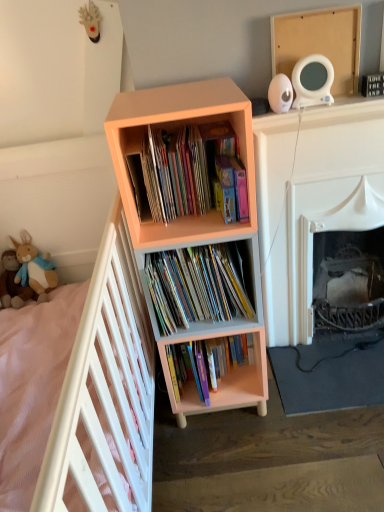
Question: Considering the relative sizes of white wooden bed at left and matte cardboard books at center, the second book when ordered from top to bottom, in the image provided, is white wooden bed at left taller than matte cardboard books at center, the second book when ordered from top to bottom,?

Choices:
 (A) no
 (B) yes

Answer: (B)

Question: Is white wooden bed at left thinner than matte cardboard books at center, which is the 2th book in bottom-to-top order?

Choices:
 (A) yes
 (B) no

Answer: (B)

Question: Is white wooden bed at left facing towards matte cardboard books at center, the second book when ordered from top to bottom?

Choices:
 (A) yes
 (B) no

Answer: (A)

Question: From a real-world perspective, is white wooden bed at left below matte cardboard books at center, which is the 2th book in bottom-to-top order?

Choices:
 (A) no
 (B) yes

Answer: (B)

Question: From a real-world perspective, is white wooden bed at left on top of matte cardboard books at center, the second book when ordered from top to bottom?

Choices:
 (A) no
 (B) yes

Answer: (A)

Question: From a real-world perspective, is hardcover books at center, the 3th book viewed from the top, positioned above or below brown plush toy at lower left, which appears as the 1th toy when viewed from the right?

Choices:
 (A) below
 (B) above

Answer: (A)

Question: Is hardcover books at center, the 3th book viewed from the top, in front of or behind brown plush toy at lower left, which appears as the 1th toy when viewed from the right, in the image?

Choices:
 (A) behind
 (B) front

Answer: (B)

Question: Considering the positions of hardcover books at center, the 3th book viewed from the top, and brown plush toy at lower left, the second toy viewed from the left, in the image, is hardcover books at center, the 3th book viewed from the top, taller or shorter than brown plush toy at lower left, the second toy viewed from the left,?

Choices:
 (A) short
 (B) tall

Answer: (B)

Question: Would you say hardcover books at center, the 3th book viewed from the top, is to the left or to the right of brown plush toy at lower left, which appears as the 1th toy when viewed from the right, in the picture?

Choices:
 (A) left
 (B) right

Answer: (B)

Question: Would you say white wooden bed at left is to the left or to the right of brown plush toy at lower left, which appears as the 1th toy when viewed from the right, in the picture?

Choices:
 (A) left
 (B) right

Answer: (B)

Question: Is white wooden bed at left in front of or behind brown plush toy at lower left, the second toy viewed from the left, in the image?

Choices:
 (A) behind
 (B) front

Answer: (B)

Question: In terms of height, does white wooden bed at left look taller or shorter compared to brown plush toy at lower left, which appears as the 1th toy when viewed from the right?

Choices:
 (A) short
 (B) tall

Answer: (B)

Question: Considering the positions of white wooden bed at left and brown plush toy at lower left, which appears as the 1th toy when viewed from the right, in the image, is white wooden bed at left bigger or smaller than brown plush toy at lower left, which appears as the 1th toy when viewed from the right,?

Choices:
 (A) big
 (B) small

Answer: (A)

Question: Relative to white wooden bed at left, is soft plush toy at left, the first toy positioned from the left, in front or behind?

Choices:
 (A) behind
 (B) front

Answer: (A)

Question: Is soft plush toy at left, the first toy positioned from the left, inside or outside of white wooden bed at left?

Choices:
 (A) outside
 (B) inside

Answer: (B)